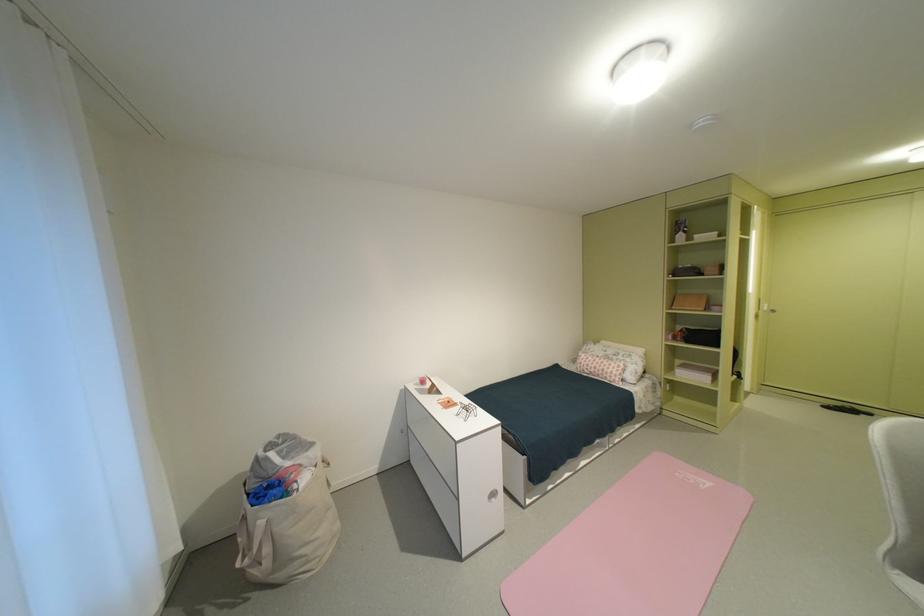
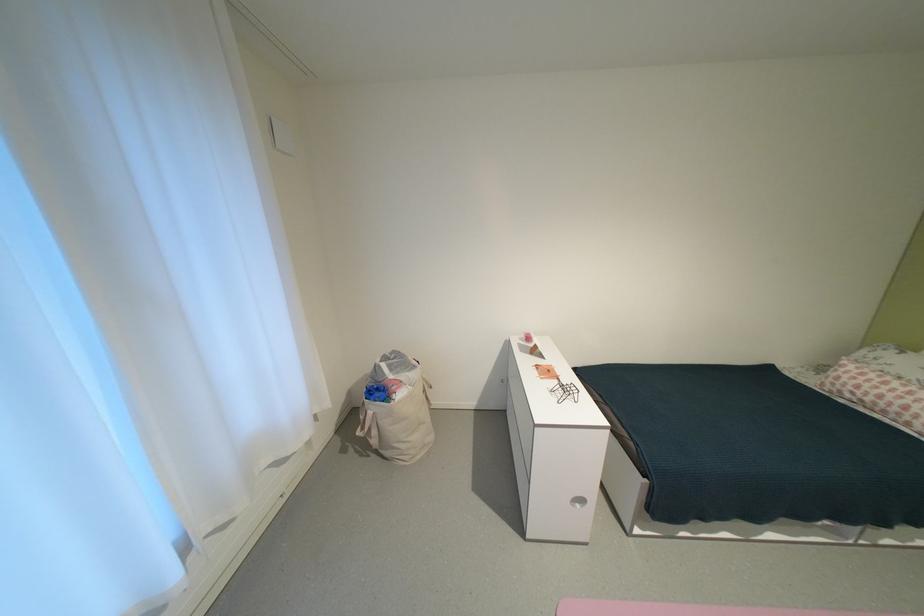
Question: The camera is either moving clockwise (left) or counter-clockwise (right) around the object. The first image is from the beginning of the video and the second image is from the end. Is the camera moving left or right when shooting the video?

Choices:
 (A) Left
 (B) Right

Answer: (B)